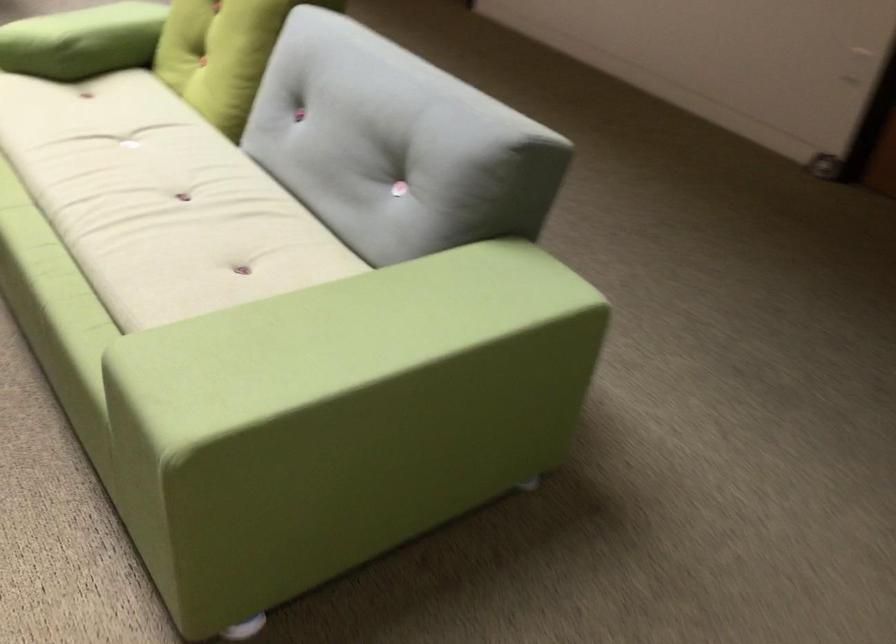
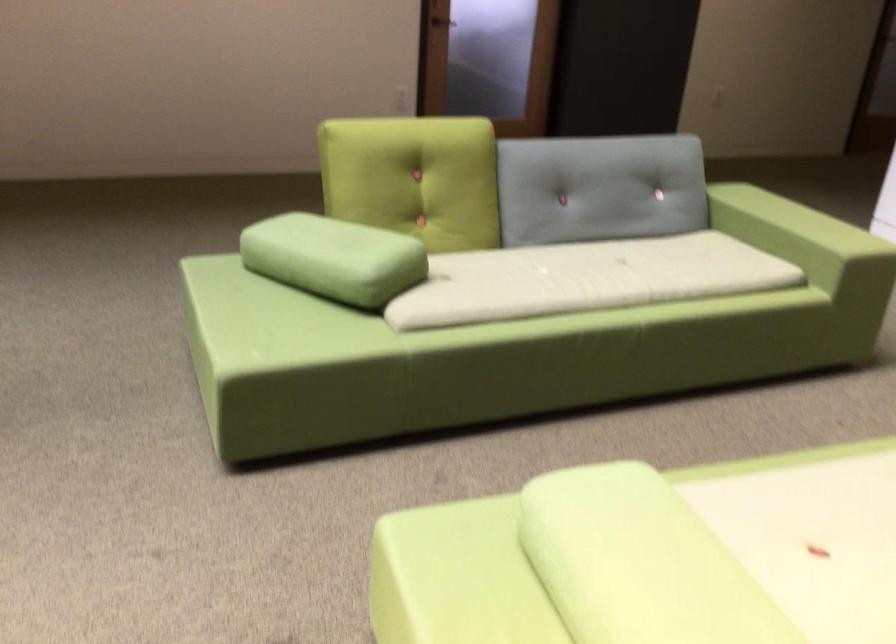
In the second image, find the point that corresponds to (x=238, y=327) in the first image.

(794, 241)